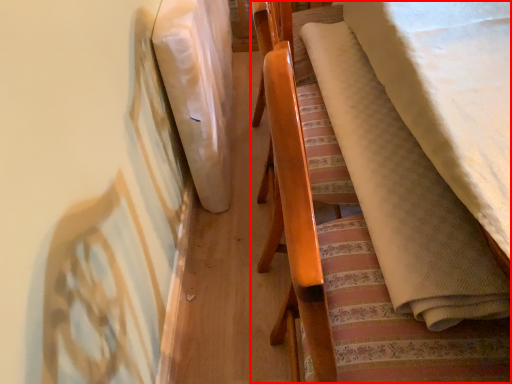
Question: From the image's perspective, what is the correct spatial relationship of furniture (annotated by the red box) in relation to blanket?

Choices:
 (A) above
 (B) below

Answer: (B)